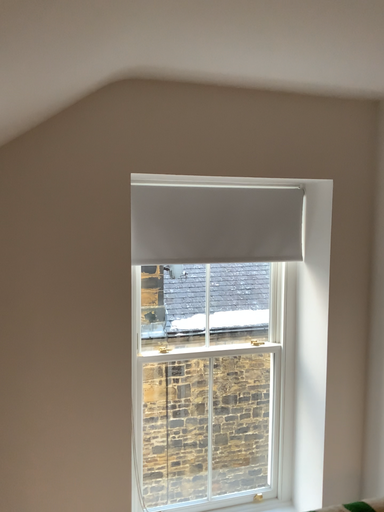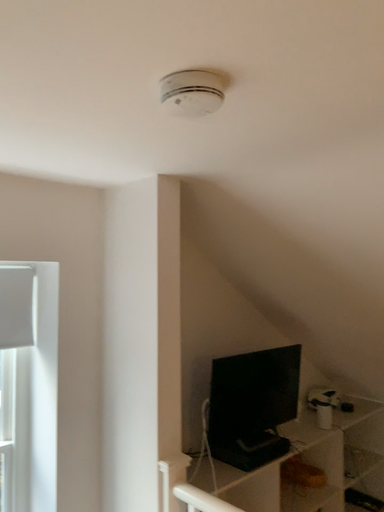
Question: How did the camera likely rotate when shooting the video?

Choices:
 (A) rotated downward
 (B) rotated upward

Answer: (B)